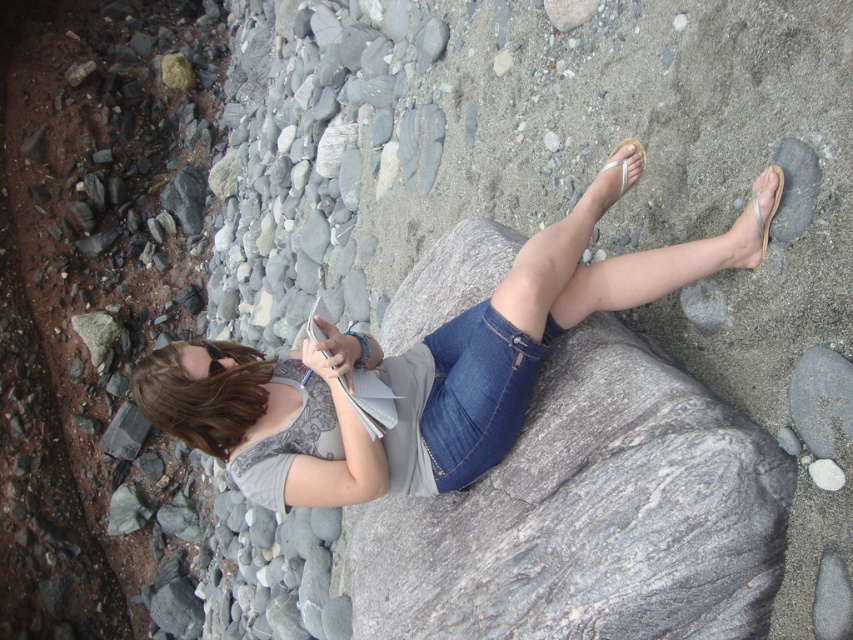
Between denim shorts at center and brown hair at center, which one is positioned higher?

Positioned higher is denim shorts at center.

Looking at this image, does denim shorts at center have a lesser height compared to brown hair at center?

No.

Find the location of a particular element. The height and width of the screenshot is (640, 853). denim shorts at center is located at coordinates (424, 365).

Does gray/granite boulder at center have a greater height compared to denim shorts at center?

Incorrect, gray/granite boulder at center's height is not larger of denim shorts at center's.

Is gray/granite boulder at center above denim shorts at center?

No, gray/granite boulder at center is not above denim shorts at center.

Is point (619, 342) closer to viewer compared to point (305, 381)?

Yes, it is.

At what (x,y) coordinates should I click in order to perform the action: click on gray/granite boulder at center. Please return your answer as a coordinate pair (x, y). This screenshot has height=640, width=853. Looking at the image, I should click on (589, 516).

Is gray/granite boulder at center to the left of brown hair at center from the viewer's perspective?

Incorrect, gray/granite boulder at center is not on the left side of brown hair at center.

Is gray/granite boulder at center above brown hair at center?

No, gray/granite boulder at center is not above brown hair at center.

Between point (666, 392) and point (221, 422), which one is positioned behind?

The point (221, 422) is more distant.

This screenshot has width=853, height=640. I want to click on gray/granite boulder at center, so click(x=589, y=516).